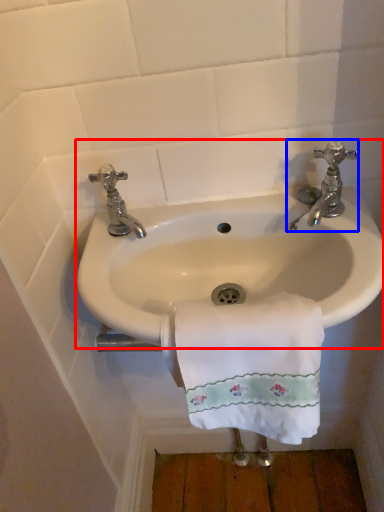
Question: Which point is further to the camera, sink (highlighted by a red box) or tap (highlighted by a blue box)?

Choices:
 (A) sink
 (B) tap

Answer: (B)